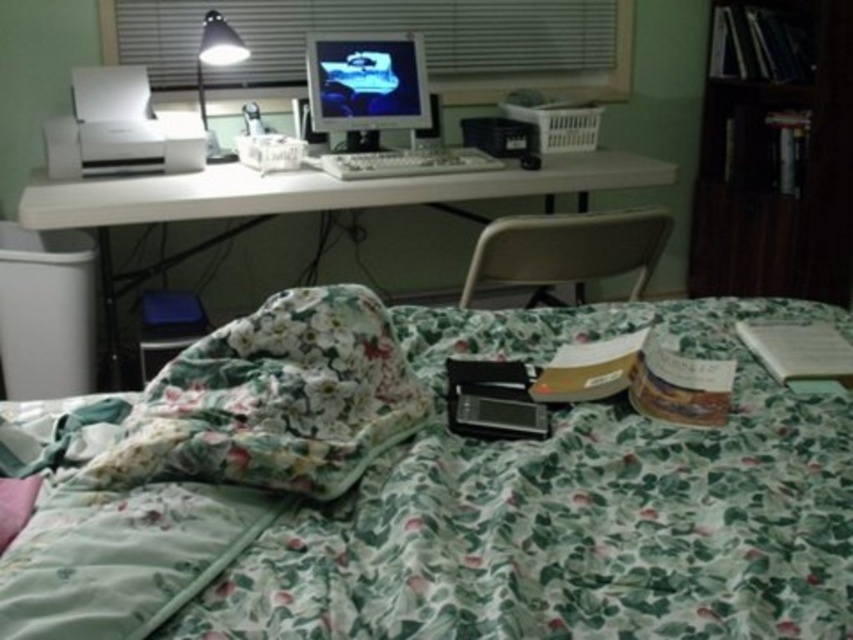
You are organizing the room and want to move the white matte printer at upper left closer to the wall. The white plastic computer desk at upper center is currently blocking the path. Can you move the desk first to access the printer?

The white plastic computer desk at upper center is in front of the white matte printer at upper left, so you can move the desk first to access the printer.

You are standing at the bed and want to reach the desk. There are two points marked in the room. The first point is at coordinates point (x=816, y=156) and the second point is at point (x=442, y=88). Which point is closer to you as you stand at the bed?

Point (x=816, y=156) is in front of point (x=442, y=88), so it is closer to you when standing at the bed.